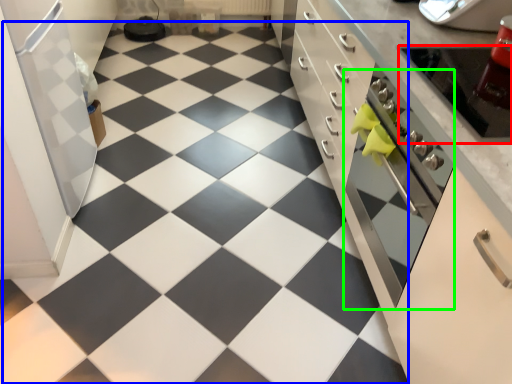
Question: Based on their relative distances, which object is farther from appliance (highlighted by a red box)? Choose from tile (highlighted by a blue box) and oven (highlighted by a green box).

Choices:
 (A) tile
 (B) oven

Answer: (A)